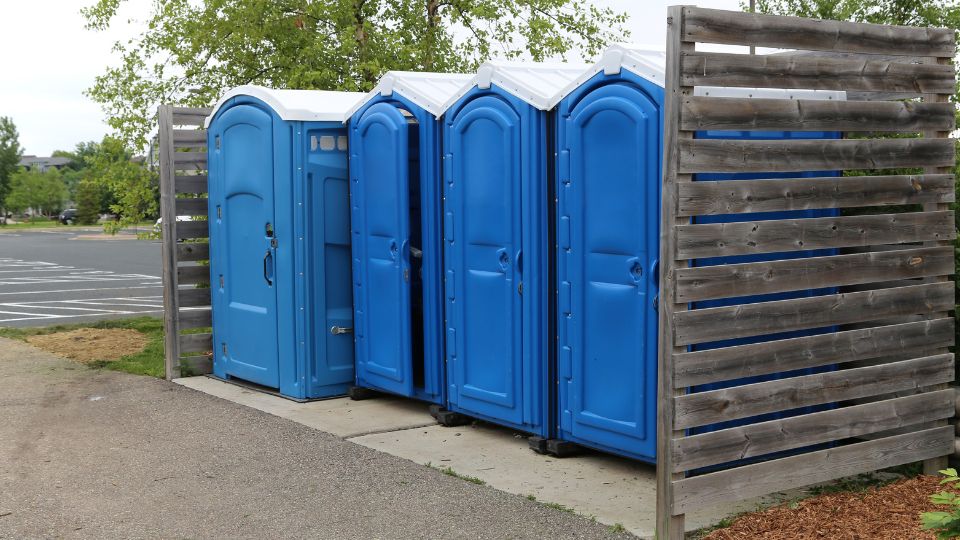
Locate an element on the screen. The width and height of the screenshot is (960, 540). handle is located at coordinates (267, 273).